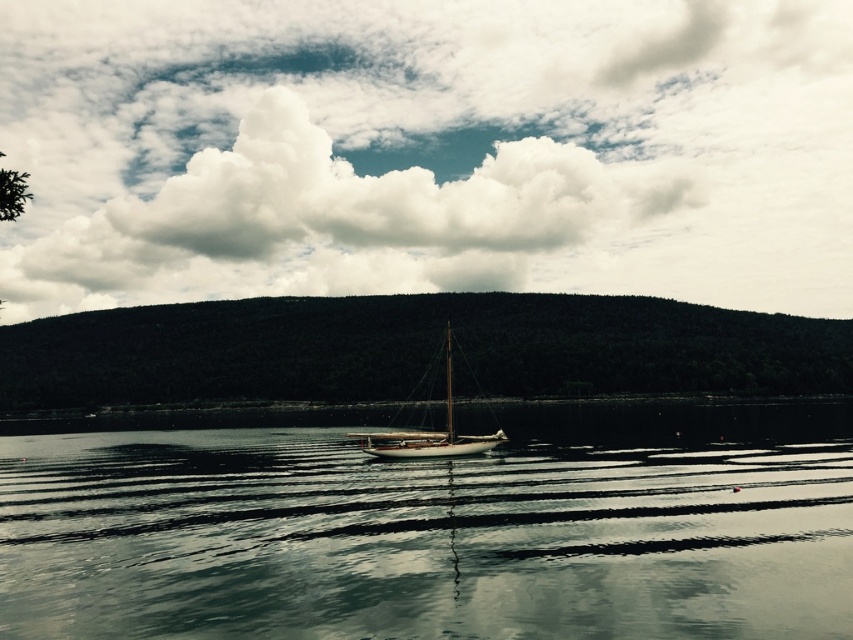
You are an airplane pilot flying at an altitude of 3000 meters. You need to navigate around a white fluffy cloud at upper center. According to the coordinates provided, is the cloud at point (427, 150) in the image located in the upper half of the scene?

Yes, the white fluffy cloud at upper center is located at point (427, 150), which is in the upper half of the scene since the y coordinate is above 0.5.